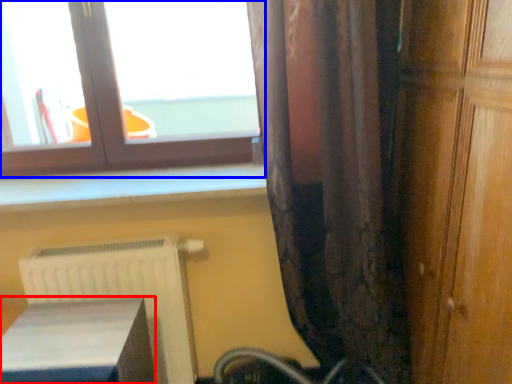
Question: Which of the following is the closest to the observer, furniture (highlighted by a red box) or window (highlighted by a blue box)?

Choices:
 (A) furniture
 (B) window

Answer: (A)